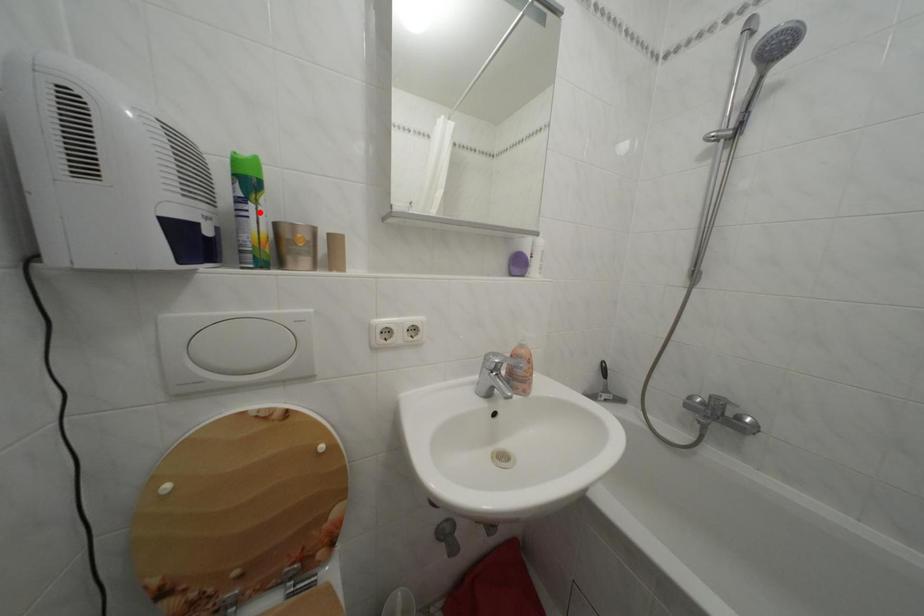
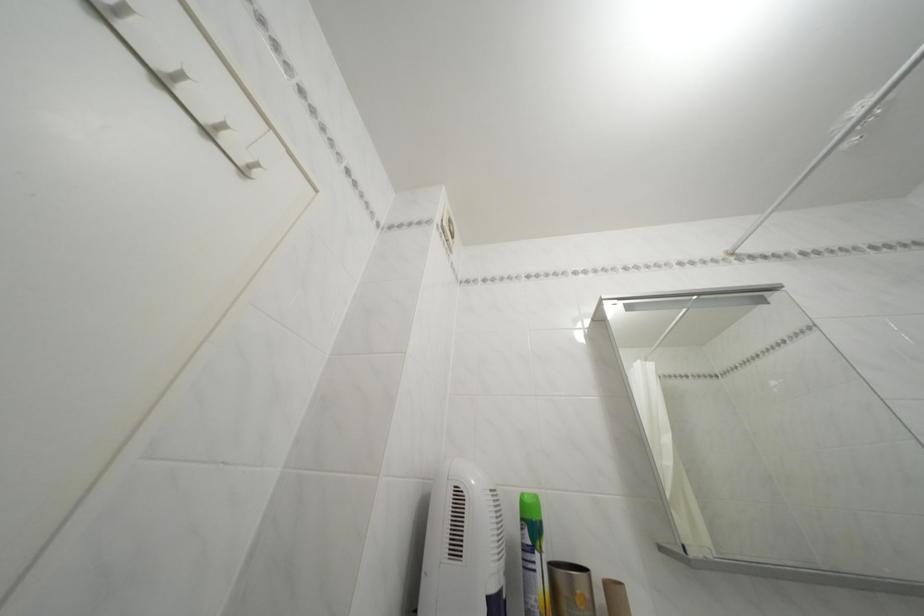
Find the pixel in the second image that matches the highlighted location in the first image.

(545, 562)